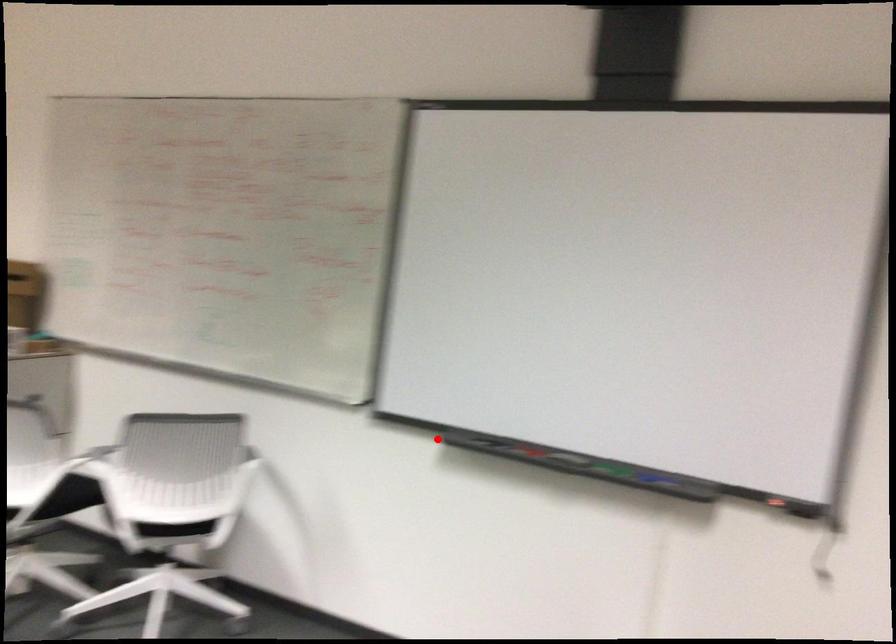
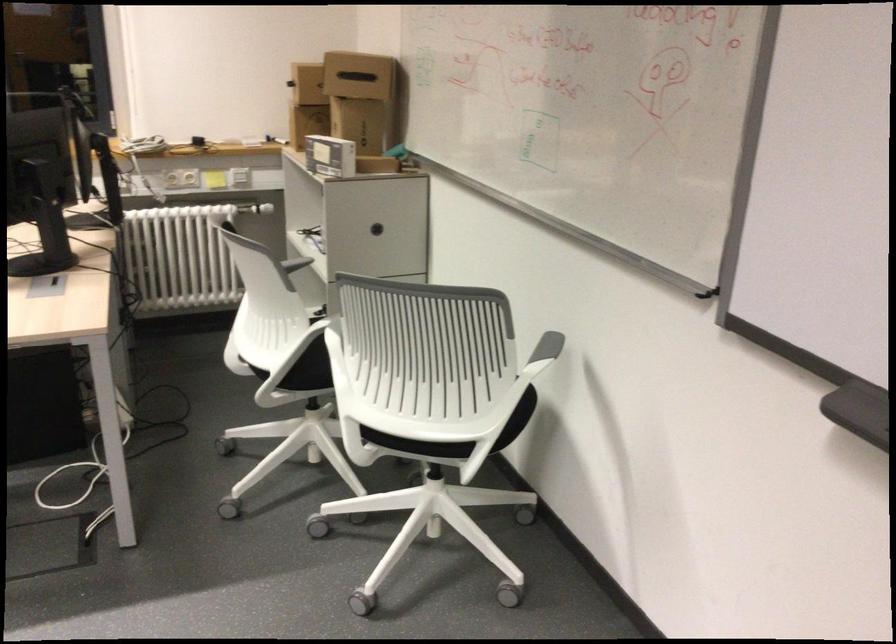
Question: I am providing you with two images of the same scene from different viewpoints. Given a red point in image1, look at the same physical point in image2. Is it:

Choices:
 (A) Closer to the viewpoint
 (B) Farther from the viewpoint

Answer: (A)